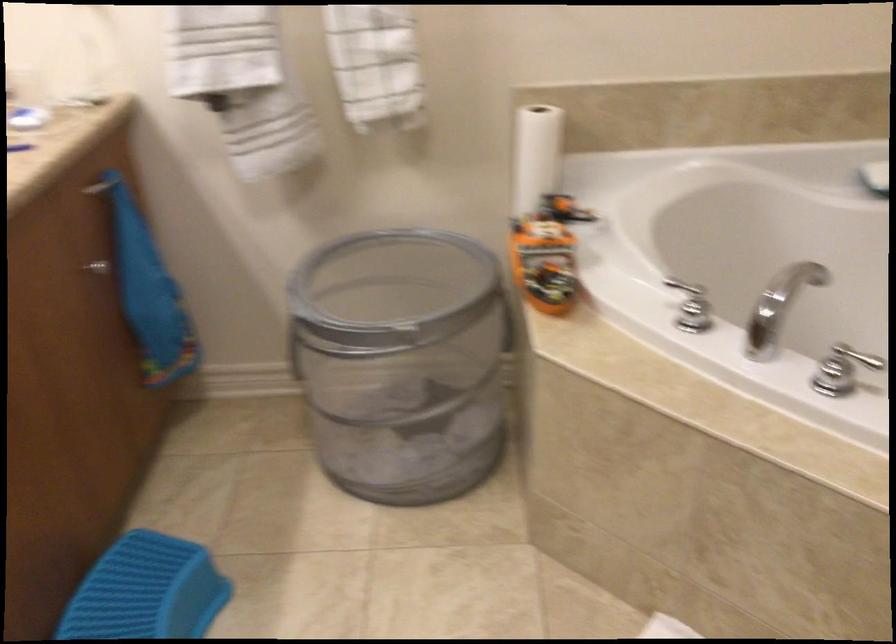
Find where to turn the silver cabinet knob. Please return your answer as a coordinate pair (x, y).

(97, 267)